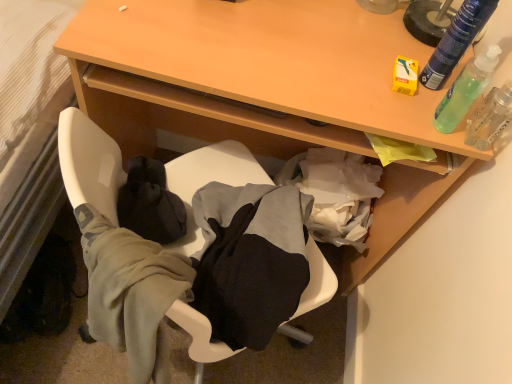
Question: From their relative heights in the image, would you say clear plastic spray bottle at upper right is taller or shorter than green translucent bottle at upper right, which appears as the 2th bottle when ordered from the bottom?

Choices:
 (A) short
 (B) tall

Answer: (A)

Question: Would you say clear plastic spray bottle at upper right is inside or outside green translucent bottle at upper right, the 1th bottle positioned from the top?

Choices:
 (A) outside
 (B) inside

Answer: (A)

Question: Which is nearer to the green translucent bottle at upper right, the 2th bottle in the top-to-bottom sequence?

Choices:
 (A) clear plastic spray bottle at upper right
 (B) wooden table at upper center
 (C) soft fabric chair at lower center
 (D) green translucent bottle at upper right, the 1th bottle positioned from the top

Answer: (D)

Question: Based on their relative distances, which object is farther from the green translucent bottle at upper right, the 1th bottle positioned from the top?

Choices:
 (A) clear plastic spray bottle at upper right
 (B) green translucent bottle at upper right, positioned as the 1th bottle in bottom-to-top order
 (C) soft fabric chair at lower center
 (D) wooden table at upper center

Answer: (C)